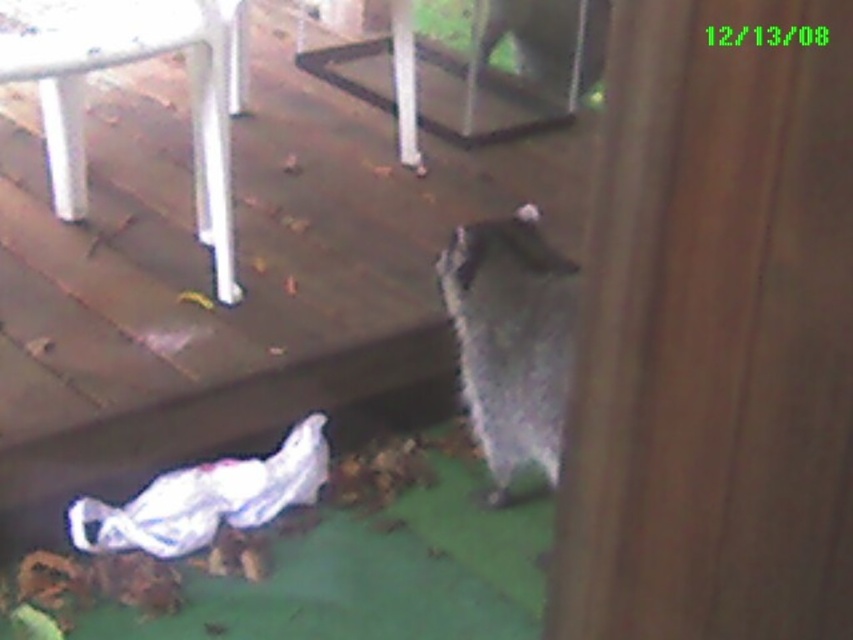
You are a delivery person with a package that requires a 3.5 feet wide path to move through. You see the brown wood screen door at right and the white plastic chair at upper left. Can you pass between them?

The distance between the brown wood screen door at right and the white plastic chair at upper left is 4.28 feet, which is wider than the required 3.5 feet. Therefore, you can pass between them.

You are standing inside the building looking out the window. There is a point marked at coordinates (120, 64) in the image. Which object from the scene does this point belong to?

The point at coordinates (120, 64) is on the white plastic chair at upper left.

You are trying to place a small potted plant on either the wooden deck at lower left or the white plastic chair at upper left. Based on their sizes, which surface would be more stable for the plant?

The wooden deck at lower left has a larger width than the white plastic chair at upper left, so placing the small potted plant on the wooden deck at lower left would provide a more stable surface.